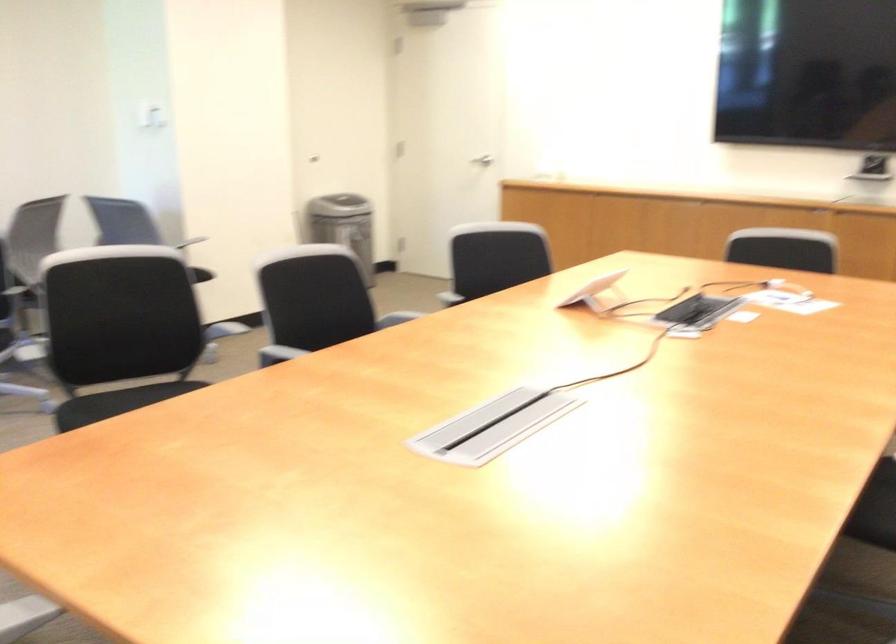
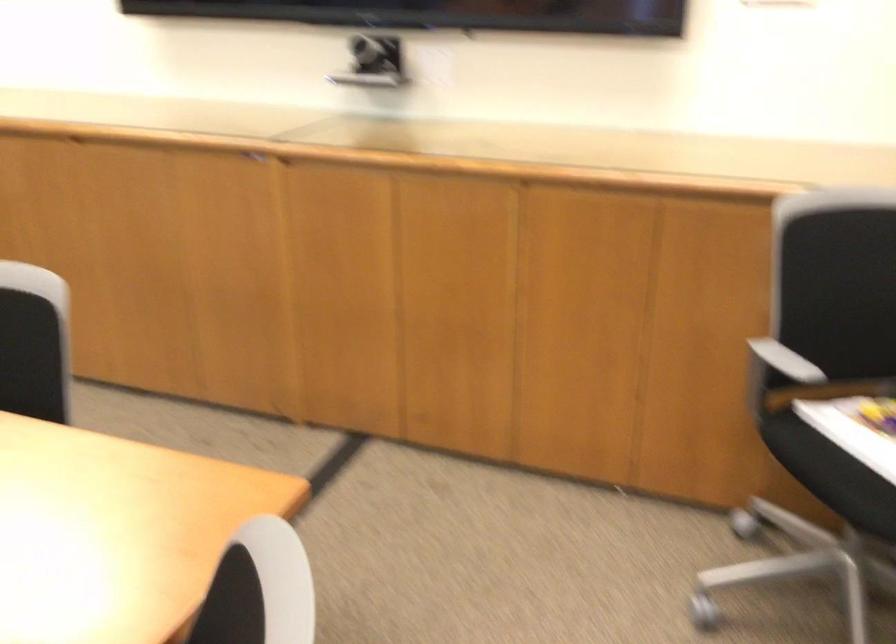
The images are taken continuously from a first-person perspective. In which direction are you moving?

The movement direction of the cameraman is right, forward.